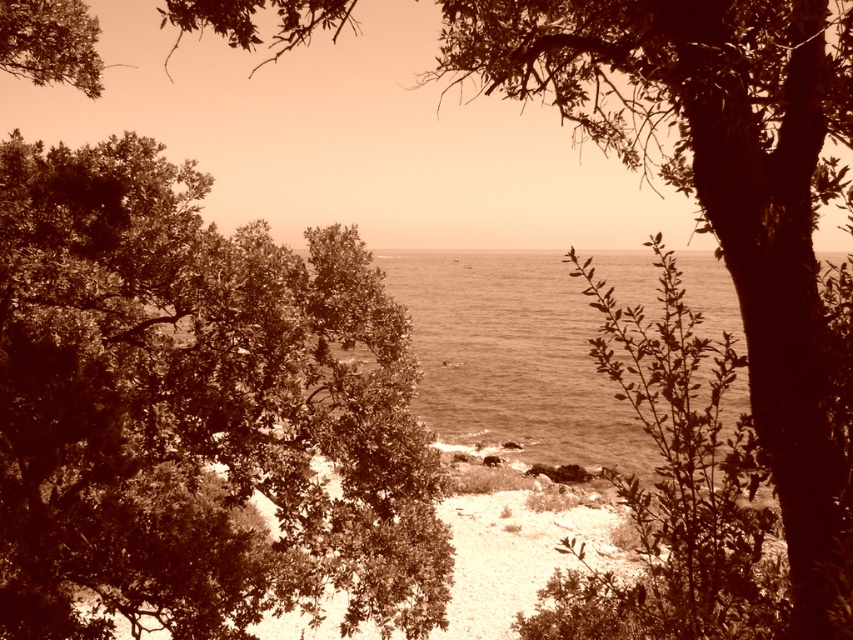
You are standing at the center of the image and want to locate the green leafy tree at center. According to the coordinates provided, in which direction should you look to find it?

The green leafy tree at center is located at coordinates point [196,410], so you should look to the upper right direction from the center to find it.

You are a photographer standing at the edge of the forest, wanting to capture a photo that includes both the green leafy tree at center and the sepia water at center. Given that your camera has a maximum focus range of 100 feet, will you be able to capture both subjects in focus without moving your position?

The green leafy tree at center is 100.65 feet from the sepia water at center. Since the distance between them exceeds the camera maximum focus range of 100 feet, you won wait be able to capture both subjects in focus without moving your position.

You are a photographer trying to capture the green leafy tree at center and the sepia water at center in a single shot. Based on the scene, which object would appear closer to the camera in your photo?

The green leafy tree at center appears closer to the camera because it is positioned in front of the sepia water at center.